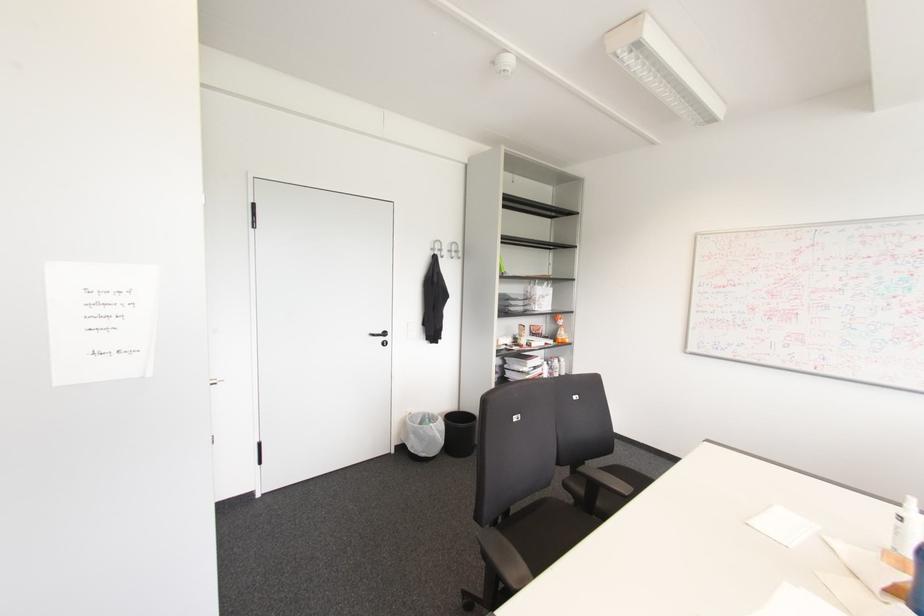
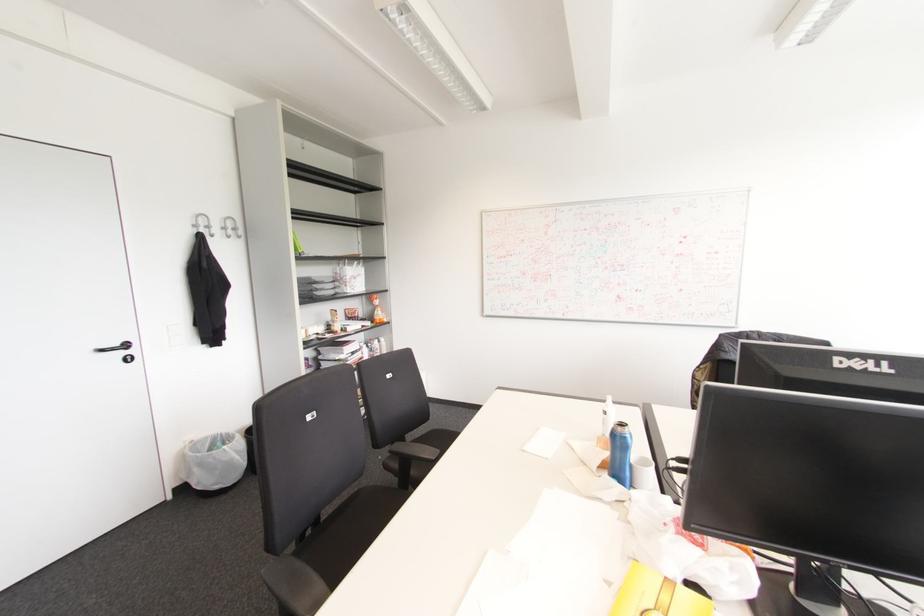
Question: The camera is either moving clockwise (left) or counter-clockwise (right) around the object. The first image is from the beginning of the video and the second image is from the end. Is the camera moving left or right when shooting the video?

Choices:
 (A) Left
 (B) Right

Answer: (A)